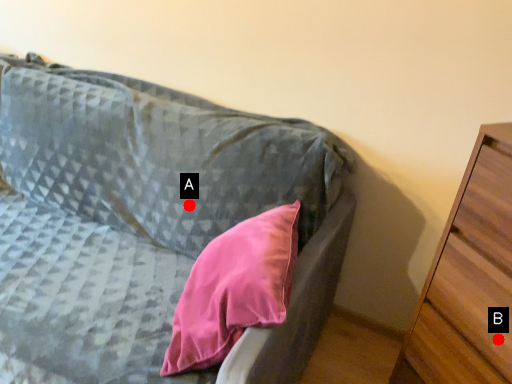
Question: Two points are circled on the image, labeled by A and B beside each circle. Among these points, which one is farthest from the camera?

Choices:
 (A) A is further
 (B) B is further

Answer: (A)